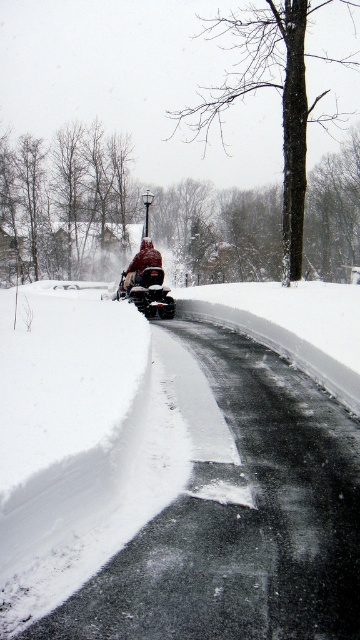
Question: Is shiny red snowmobile at center to the left of red knit hat at center from the viewer's perspective?

Choices:
 (A) no
 (B) yes

Answer: (A)

Question: Which object is closer to the camera taking this photo?

Choices:
 (A) shiny red snowmobile at center
 (B) red knit hat at center

Answer: (A)

Question: Is shiny red snowmobile at center bigger than red knit hat at center?

Choices:
 (A) no
 (B) yes

Answer: (A)

Question: Does shiny red snowmobile at center appear over red knit hat at center?

Choices:
 (A) yes
 (B) no

Answer: (B)

Question: Which of the following is the farthest from the observer?

Choices:
 (A) tap(132, 282)
 (B) tap(154, 289)

Answer: (A)